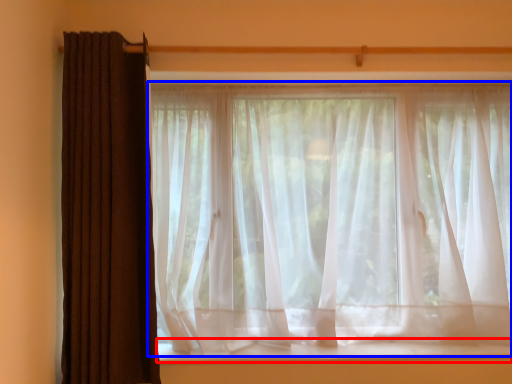
Question: Which of the following is the closest to the observer, window sill (highlighted by a red box) or curtain (highlighted by a blue box)?

Choices:
 (A) window sill
 (B) curtain

Answer: (B)